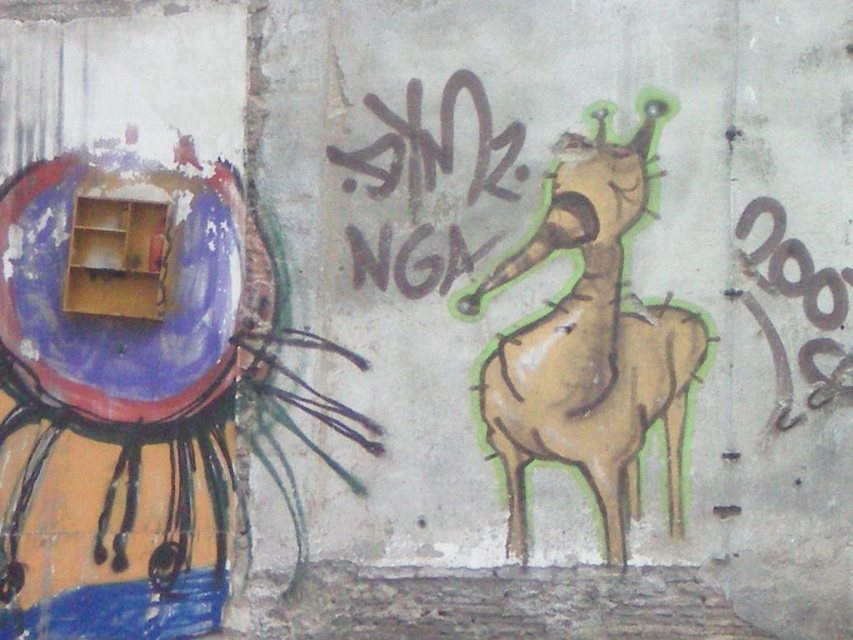
What do you see at coordinates (590, 344) in the screenshot? This screenshot has height=640, width=853. I see `beige textured giraffe at center` at bounding box center [590, 344].

Does point (619, 250) come in front of point (844, 376)?

No, (619, 250) is further to viewer.

The height and width of the screenshot is (640, 853). I want to click on beige textured giraffe at center, so click(590, 344).

Is point (695, 348) farther from viewer compared to point (416, 161)?

No, (695, 348) is closer to viewer.

Between beige textured giraffe at center and black graffiti at center, which one has less height?

With less height is black graffiti at center.

Is point (689, 320) closer to viewer compared to point (407, 246)?

Yes.

Locate an element on the screen. The image size is (853, 640). beige textured giraffe at center is located at coordinates (590, 344).

Between black graffiti at center and black graffiti at right, which one appears on the left side from the viewer's perspective?

From the viewer's perspective, black graffiti at center appears more on the left side.

Is point (479, 250) farther from viewer compared to point (846, 368)?

Yes, it is.

Locate an element on the screen. Image resolution: width=853 pixels, height=640 pixels. black graffiti at center is located at coordinates [433, 145].